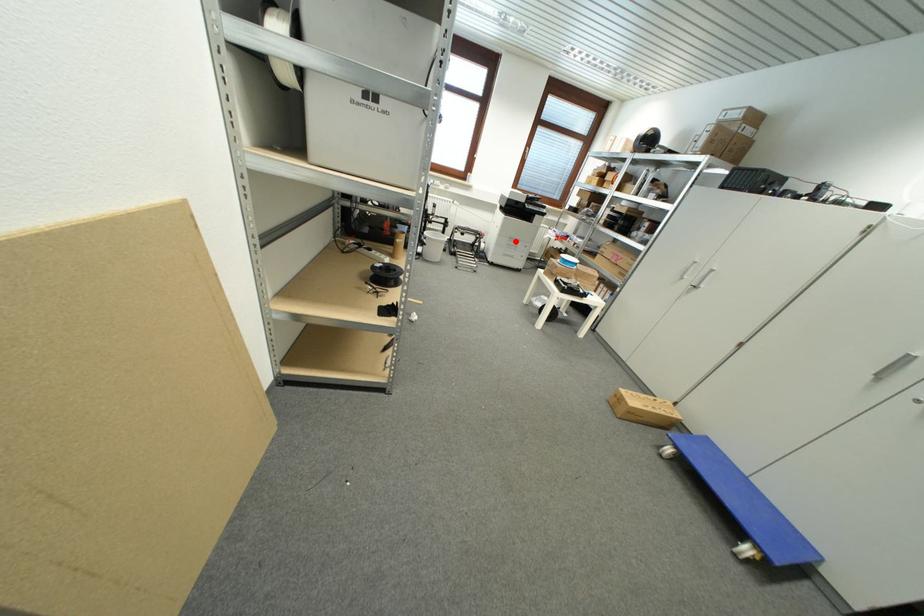
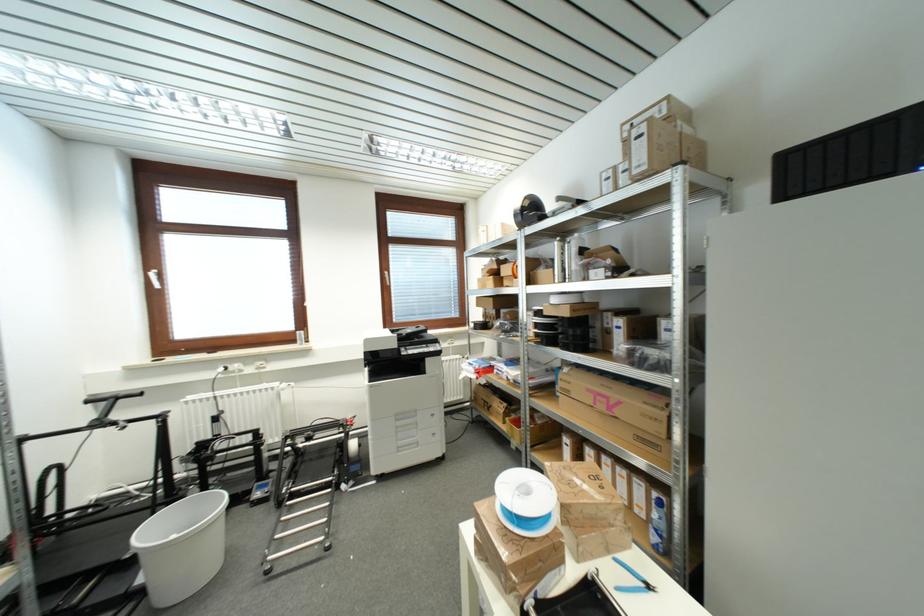
Question: I am providing you with two images of the same scene from different viewpoints. In image1, a red point is highlighted. Considering the same 3D point in image2, which of the following is correct?

Choices:
 (A) It is closer
 (B) It is farther

Answer: (B)